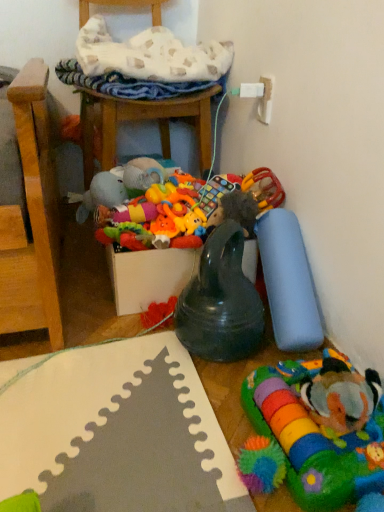
Identify the location of vacant area on top of multicolored plush toy at lower right, which appears as the second toy when viewed from the right (from a real-world perspective). The width and height of the screenshot is (384, 512). (316, 409).